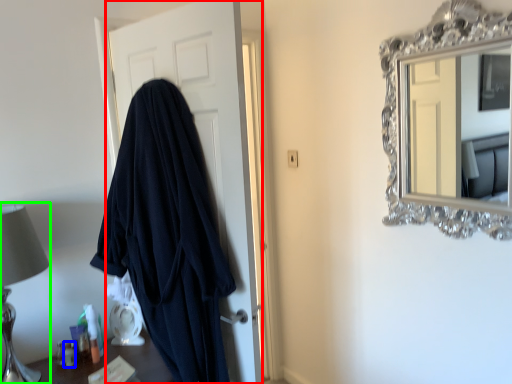
Question: Which object is the closest to the door (highlighted by a red box)? Choose among these: toiletry (highlighted by a blue box) or table lamp (highlighted by a green box).

Choices:
 (A) toiletry
 (B) table lamp

Answer: (B)